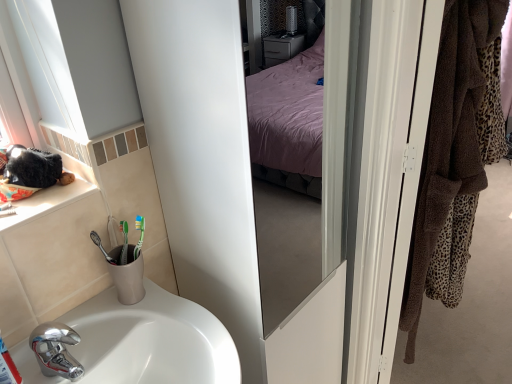
Where is `free spot above white ceramic window sill at left (from a real-world perspective)`? Image resolution: width=512 pixels, height=384 pixels. free spot above white ceramic window sill at left (from a real-world perspective) is located at coordinates (28, 193).